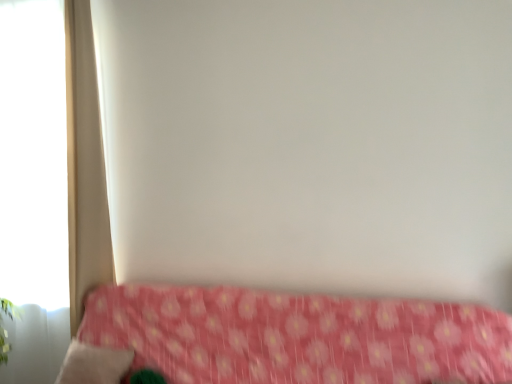
You are a GUI agent. You are given a task and a screenshot of the screen. Output one action in this format:
    pyautogui.click(x=<x>, y=<y>)
    Task: Click on the white matte window at left
    
    Given the screenshot: What is the action you would take?
    pyautogui.click(x=33, y=154)

The image size is (512, 384). Find the location of `white fabric curtain at left`. white fabric curtain at left is located at coordinates (85, 165).

This screenshot has width=512, height=384. Identify the location of white matte window at left. (33, 154).

Considering the sizes of white matte window at left and white fabric curtain at left in the image, is white matte window at left taller or shorter than white fabric curtain at left?

white matte window at left is taller than white fabric curtain at left.

Is white matte window at left not inside white fabric curtain at left?

Yes, white matte window at left is not within white fabric curtain at left.

Which is more to the left, white matte window at left or white fabric curtain at left?

From the viewer's perspective, white matte window at left appears more on the left side.

Consider the image. Could you tell me if white matte window at left is turned towards white fabric curtain at left?

No, white matte window at left does not turn towards white fabric curtain at left.

Between beige fabric pillow at lower left and pink floral fabric at lower center, which one appears on the left side from the viewer's perspective?

beige fabric pillow at lower left.

Is beige fabric pillow at lower left surrounding pink floral fabric at lower center?

Definitely not — pink floral fabric at lower center is not inside beige fabric pillow at lower left.

Does point (66, 366) appear closer or farther from the camera than point (415, 316)?

Point (66, 366) is farther from the camera than point (415, 316).

You are a GUI agent. You are given a task and a screenshot of the screen. Output one action in this format:
    pyautogui.click(x=<x>, y=<y>)
    Task: Click on the pillow below the pink floral fabric at lower center (from the image's perspective)
    Image resolution: width=512 pixels, height=384 pixels.
    Given the screenshot: What is the action you would take?
    [94, 364]

Would you say white matte window at left is inside or outside beige fabric pillow at lower left?

white matte window at left cannot be found inside beige fabric pillow at lower left.

Considering the relative positions of white matte window at left and beige fabric pillow at lower left in the image provided, is white matte window at left to the left or to the right of beige fabric pillow at lower left?

white matte window at left is to the left of beige fabric pillow at lower left.

Which object is more forward, white matte window at left or beige fabric pillow at lower left?

beige fabric pillow at lower left is closer to the camera.

Consider the image. Measure the distance between white matte window at left and beige fabric pillow at lower left.

They are 33.10 inches apart.

Considering the sizes of objects pink floral fabric at lower center and white matte window at left in the image provided, who is taller, pink floral fabric at lower center or white matte window at left?

white matte window at left is taller.

Based on the photo, between pink floral fabric at lower center and white matte window at left, which one has smaller width?

With smaller width is white matte window at left.

Find the location of a particular element. window above the pink floral fabric at lower center (from the image's perspective) is located at coordinates (33, 154).

Would you say white fabric curtain at left is a long distance from beige fabric pillow at lower left?

They are positioned close to each other.

From the image's perspective, is white fabric curtain at left under beige fabric pillow at lower left?

No.

Is white fabric curtain at left bigger than beige fabric pillow at lower left?

Yes.

Identify the location of window below the white fabric curtain at left (from the image's perspective). (33, 154).

Looking at their sizes, would you say white fabric curtain at left is wider or thinner than white matte window at left?

white fabric curtain at left is wider than white matte window at left.

From a real-world perspective, who is located lower, white fabric curtain at left or white matte window at left?

white matte window at left is physically lower.

From the image's perspective, which is below, white fabric curtain at left or white matte window at left?

From the image's view, white matte window at left is below.

Is pink floral fabric at lower center beside white fabric curtain at left?

No, pink floral fabric at lower center is not touching white fabric curtain at left.

Is pink floral fabric at lower center positioned in front of white fabric curtain at left?

Yes, pink floral fabric at lower center is in front of white fabric curtain at left.

The image size is (512, 384). I want to click on curtain that is behind the pink floral fabric at lower center, so click(85, 165).

Looking at this image, which point is more forward, (166, 360) or (67, 11)?

Point (166, 360)

At what (x,y) coordinates should I click in order to perform the action: click on window on the left of white fabric curtain at left. Please return your answer as a coordinate pair (x, y). The width and height of the screenshot is (512, 384). Looking at the image, I should click on (33, 154).

I want to click on furniture that appears above the beige fabric pillow at lower left (from the image's perspective), so click(284, 338).

Estimate the real-world distances between objects in this image. Which object is closer to pink floral fabric at lower center, beige fabric pillow at lower left or white fabric curtain at left?

beige fabric pillow at lower left is positioned closer to the anchor pink floral fabric at lower center.

Considering their positions, is white fabric curtain at left positioned further to white matte window at left than beige fabric pillow at lower left?

The object further to white matte window at left is beige fabric pillow at lower left.

Looking at the image, which one is located closer to beige fabric pillow at lower left, pink floral fabric at lower center or white fabric curtain at left?

pink floral fabric at lower center lies closer to beige fabric pillow at lower left than the other object.

Considering their positions, is pink floral fabric at lower center positioned closer to white fabric curtain at left than white matte window at left?

white matte window at left is closer to white fabric curtain at left.

Considering their positions, is beige fabric pillow at lower left positioned closer to white fabric curtain at left than white matte window at left?

white matte window at left is closer to white fabric curtain at left.

Considering their positions, is pink floral fabric at lower center positioned closer to beige fabric pillow at lower left than white matte window at left?

Based on the image, pink floral fabric at lower center appears to be nearer to beige fabric pillow at lower left.

Looking at this image, considering their positions, is white matte window at left positioned further to beige fabric pillow at lower left than pink floral fabric at lower center?

white matte window at left is positioned further to the anchor beige fabric pillow at lower left.

When comparing their distances from pink floral fabric at lower center, does beige fabric pillow at lower left or white matte window at left seem further?

Among the two, white matte window at left is located further to pink floral fabric at lower center.

Find the location of `curtain located between white matte window at left and pink floral fabric at lower center in the left-right direction`. curtain located between white matte window at left and pink floral fabric at lower center in the left-right direction is located at coordinates (85, 165).

Where is `pillow between pink floral fabric at lower center and white fabric curtain at left in the front-back direction`? Image resolution: width=512 pixels, height=384 pixels. pillow between pink floral fabric at lower center and white fabric curtain at left in the front-back direction is located at coordinates (94, 364).

Find the location of a particular element. The image size is (512, 384). window between white fabric curtain at left and beige fabric pillow at lower left vertically is located at coordinates (33, 154).

The image size is (512, 384). I want to click on pillow between white matte window at left and pink floral fabric at lower center from left to right, so click(94, 364).